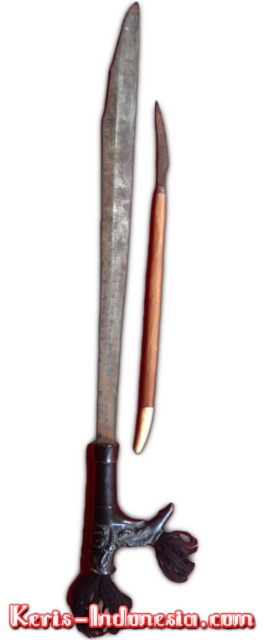
You are a photographer standing at a certain distance from the rusty metal sword at center. You want to take a closeup shot of the sword. If your camera can focus on objects within 3 feet, will you need to move closer or farther away?

The distance between you and the rusty metal sword at center is 4.06 feet. Since your camera can focus as close as 3 feet, you are currently 1.06 feet too far away. To get a closeup, you need to move closer until you are within the 3 feet range.

You are an art appraiser examining a traditional Indonesian keris displayed against a white background. You notice the shiny metallic sword at center and the black text at center. Which object is located to the left of the other?

The shiny metallic sword at center is positioned on the left side of black text at center.